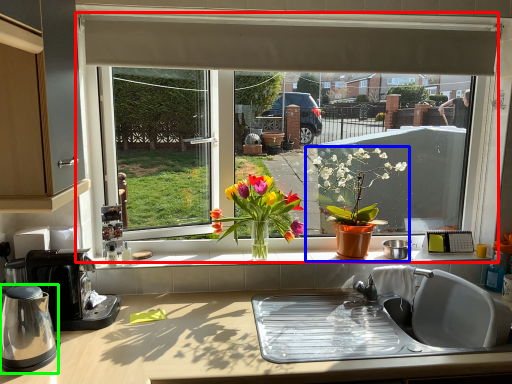
Question: Which is farther away from window (highlighted by a red box)? houseplant (highlighted by a blue box) or kitchen appliance (highlighted by a green box)?

Choices:
 (A) houseplant
 (B) kitchen appliance

Answer: (B)